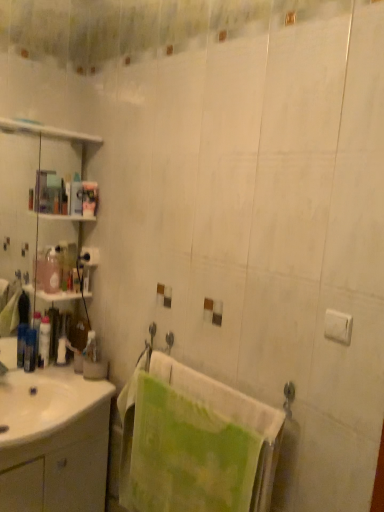
At what (x,y) coordinates should I click in order to perform the action: click on spots to the right of matte silver faucet at sink left. Please return your answer as a coordinate pair (x, y). The width and height of the screenshot is (384, 512). Looking at the image, I should click on (14, 398).